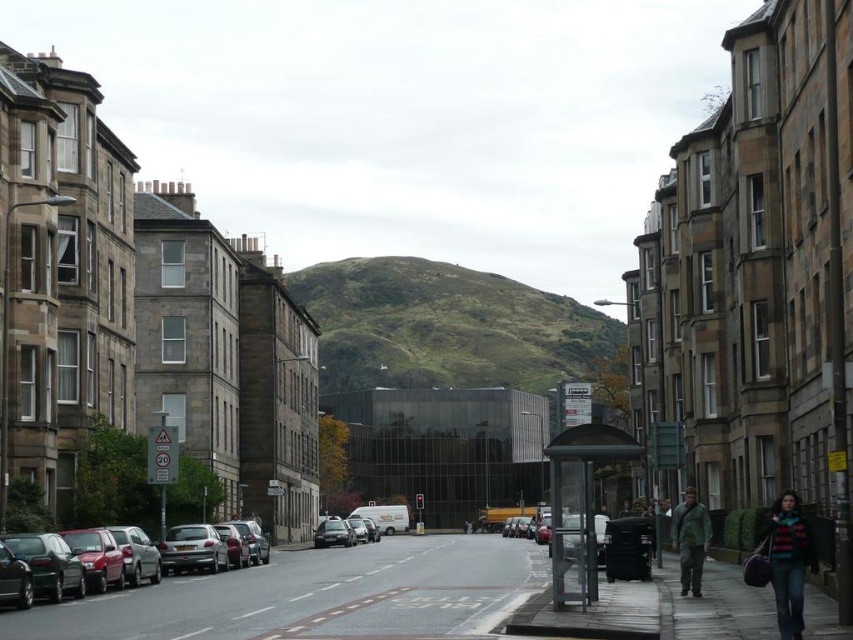
You are a tourist in Edinburgh and want to take a photo of the green grassy hill at center and the matte black car at left. You are standing on the street. Which direction should you turn to first to ensure both are in your frame?

You should turn to your right because the green grassy hill at center is to the right of the matte black car at left, so turning right will allow you to capture both in your frame.

You are a delivery person with a cart that requires a 20 meter path to maneuver. You see the concrete sidewalk at center and the striped sweater at lower right. Is there enough space between them to move your cart?

The distance between the concrete sidewalk at center and the striped sweater at lower right is 21.68 meters, which is more than the required 20 meters. Therefore, there is sufficient space to maneuver the cart between them.